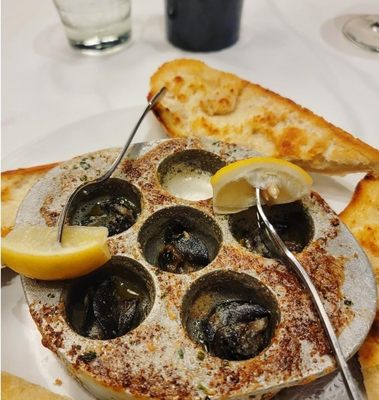
Locate an element on the screen. The width and height of the screenshot is (379, 400). glass cup is located at coordinates (95, 16).